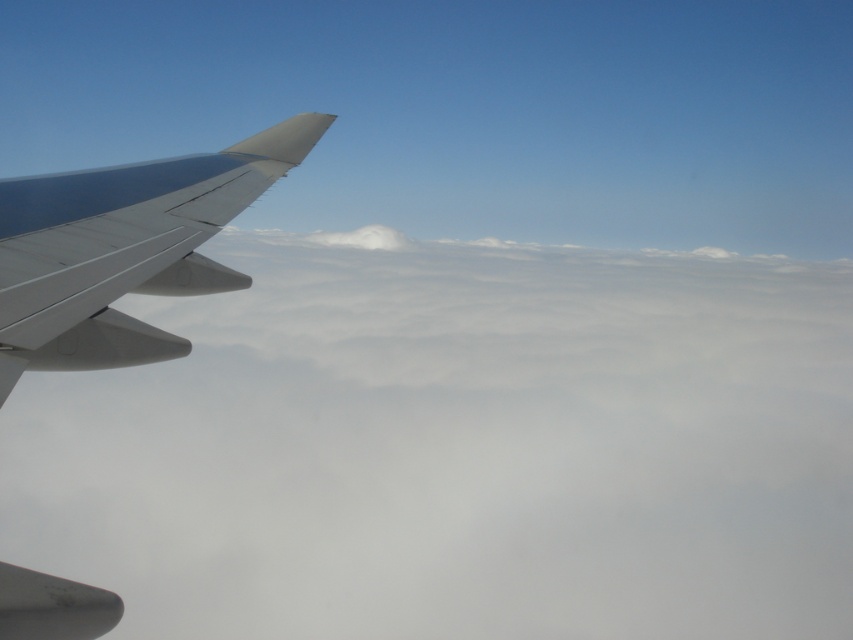
You are a passenger sitting in the aircraft and looking out the window. You notice two points marked in the scene. Which point is closer to your eyes? The points are point (648, 557) and point (142, 177).

Point (142, 177) is closer to your eyes because it is less further to the viewer than point (648, 557).

You are a passenger sitting by the window in an aircraft. You notice the white fluffy cloud at left and the metallic gray wing at left outside. Which one appears larger in size from your view?

The white fluffy cloud at left is bigger than the metallic gray wing at left, so the white fluffy cloud at left appears larger in size from your view.

You are a passenger sitting near the window on an aircraft. You notice the white fluffy cloud at left and the metallic gray wing at left outside. Which of these two objects appears wider from your seat?

The white fluffy cloud at left appears wider than the metallic gray wing at left because its width is larger.